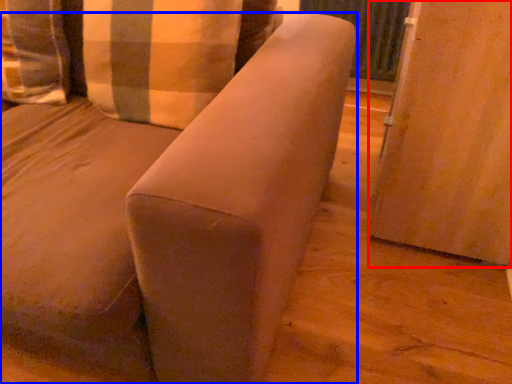
Question: Among these objects, which one is nearest to the camera, screen door (highlighted by a red box) or furniture (highlighted by a blue box)?

Choices:
 (A) screen door
 (B) furniture

Answer: (B)